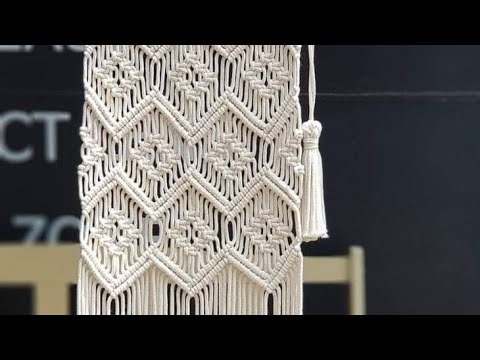
Where is `curtain`? This screenshot has height=360, width=480. curtain is located at coordinates (179, 229).